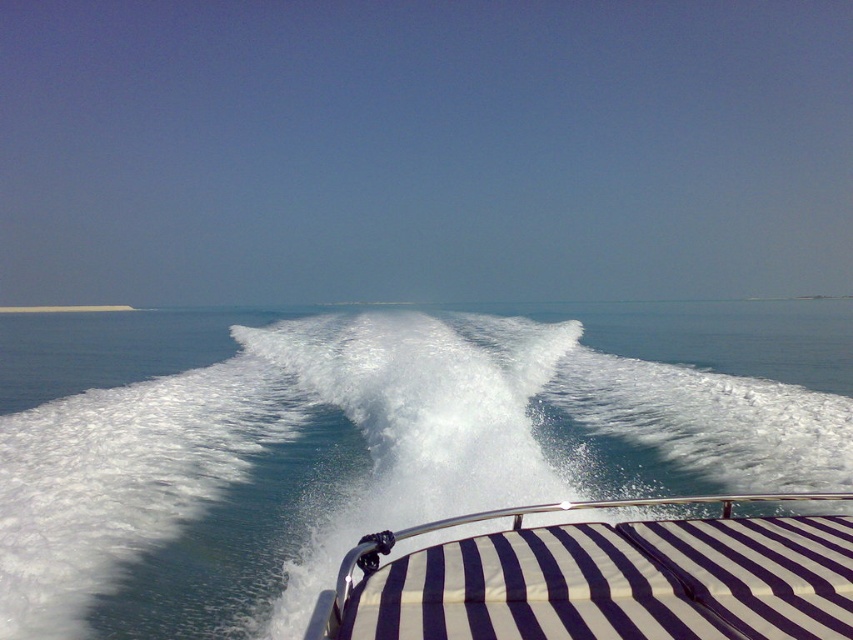
Question: Which point is closer to the camera taking this photo?

Choices:
 (A) (236, 550)
 (B) (474, 624)

Answer: (B)

Question: Is white foamy water at center closer to the viewer compared to white striped fabric at center?

Choices:
 (A) yes
 (B) no

Answer: (B)

Question: Is white foamy water at center positioned before white striped fabric at center?

Choices:
 (A) yes
 (B) no

Answer: (B)

Question: Considering the relative positions of white foamy water at center and white striped fabric at center in the image provided, where is white foamy water at center located with respect to white striped fabric at center?

Choices:
 (A) below
 (B) above

Answer: (B)

Question: Which point appears farthest from the camera in this image?

Choices:
 (A) coord(413,621)
 (B) coord(54,371)

Answer: (B)